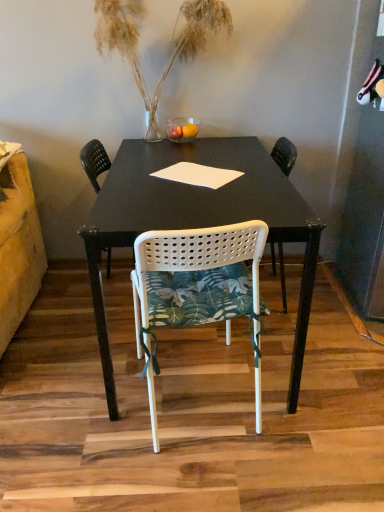
Question: Relative to translucent glass vase at upper center, is white perforated plastic chair at center, the second chair viewed from the front, in front or behind?

Choices:
 (A) front
 (B) behind

Answer: (B)

Question: In the image, is white perforated plastic chair at center, the second chair viewed from the front, on the left side or the right side of translucent glass vase at upper center?

Choices:
 (A) right
 (B) left

Answer: (B)

Question: Which is nearer to the translucent glass vase at upper center?

Choices:
 (A) white perforated plastic chair at center, arranged as the 1th chair when viewed from the back
 (B) white perforated plastic chair at center, positioned as the 1th chair in front-to-back order

Answer: (A)

Question: Based on their relative distances, which object is farther from the translucent glass vase at upper center?

Choices:
 (A) white perforated plastic chair at center, the second chair viewed from the front
 (B) white perforated plastic chair at center, positioned as the 1th chair in front-to-back order

Answer: (B)